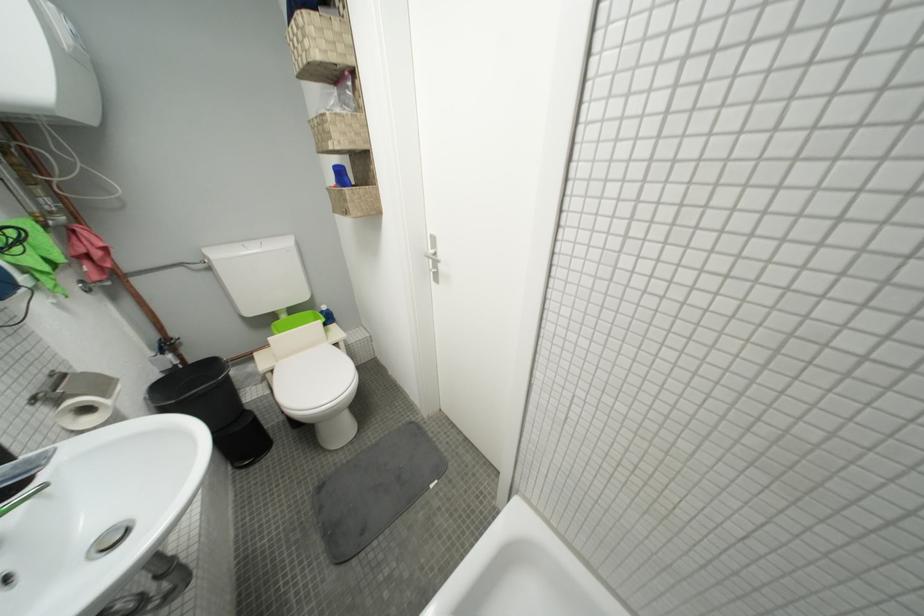
Where would you pull the toilet paper roll? Please return your answer as a coordinate pair (x, y).

(84, 400)